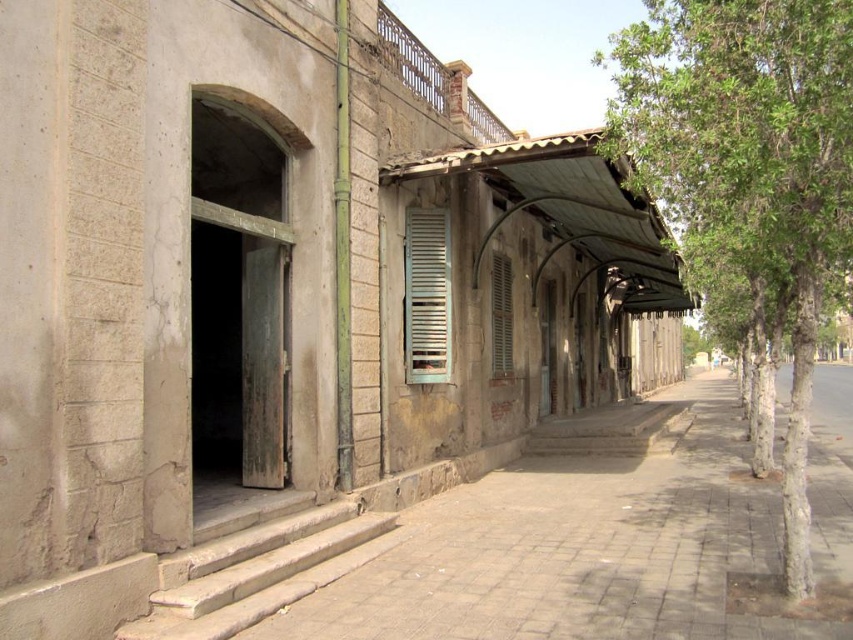
You are standing in front of the old building and want to determine the relative positions of two points marked on the walkway. Which point is closer to you, point at (579, 461) or point at (434, 292)?

Point at (434, 292) is closer to you because it is less further to the viewer than point at (579, 461).

You are standing at the entrance of the old building and want to locate the point marked as point (426,296). Based on the scene description, where would this point be located?

The point (426,296) is on the silver metallic shutter at center.

You are standing at the entrance of the old building and want to reach a specific point marked at coordinates point (434, 346). Given that the distance from your current position to this point is 32.77 feet, can you estimate how far you need to walk to reach it?

The distance of point (434, 346) from camera is 32.77 feet, so you need to walk approximately 32.77 feet to reach it.